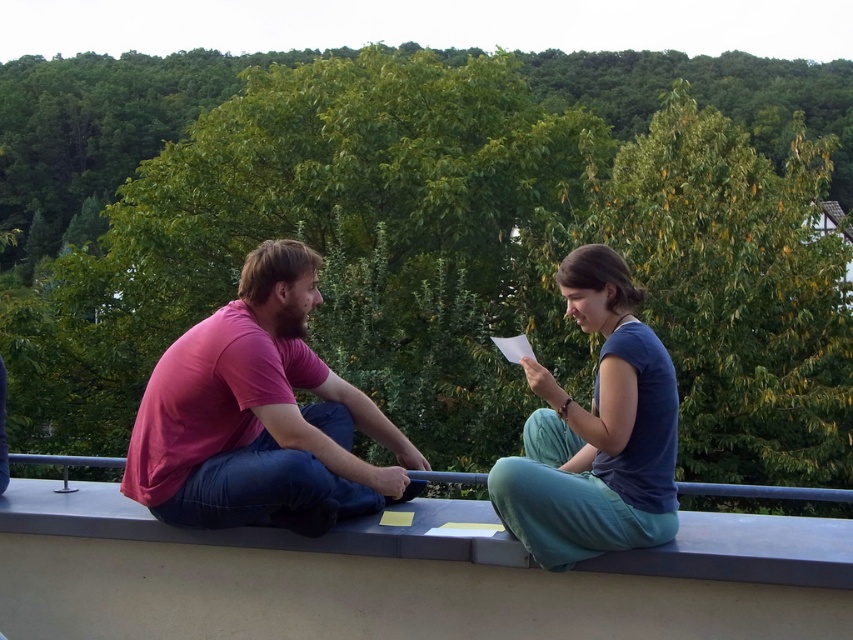
You are a photographer trying to capture a portrait of the two people sitting on the smooth concrete ledge at center. The pink cotton shirt at center is part of the subject. Considering their positions, which object should you focus on first to ensure the subject is in focus?

The pink cotton shirt at center has a greater height compared to the smooth concrete ledge at center, so you should focus on the pink cotton shirt at center first to ensure the subject is in focus.

You are a photographer trying to capture a candid shot of the two people sitting on the smooth concrete ledge at center. To get the best angle, you need to position yourself so that the pink cotton shirt at center is visible between you and the ledge. Is this possible based on their current positions?

The pink cotton shirt at center is to the left of the smooth concrete ledge at center, so positioning yourself to the right side of the ledge would allow you to see the pink cotton shirt at center in front of the ledge.

You are a drone operator trying to deliver a small package to the pink cotton shirt at center. The coordinates given are point (x=262, y=426). Is this point on the pink cotton shirt at center?

Yes, the point (x=262, y=426) is on the pink cotton shirt at center as stated in the objects description.